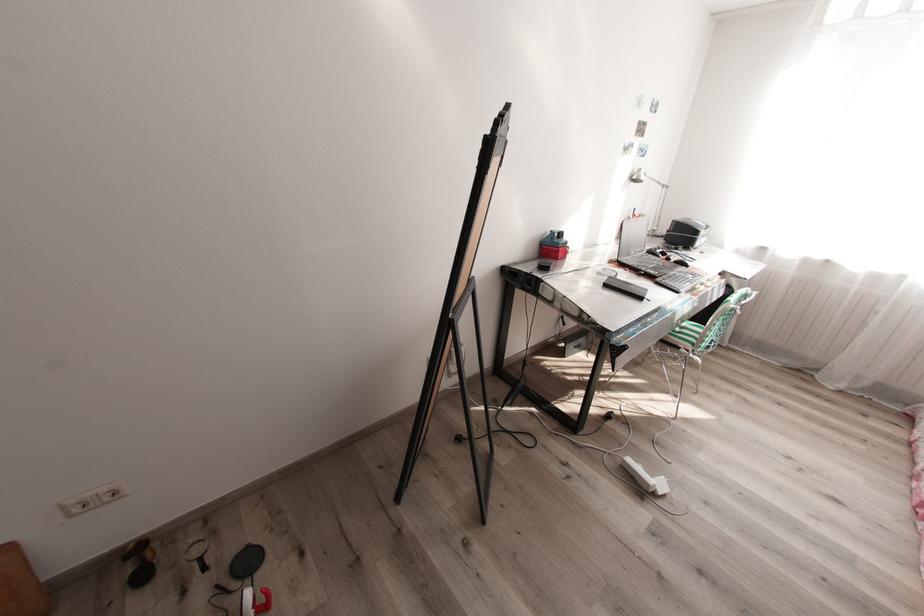
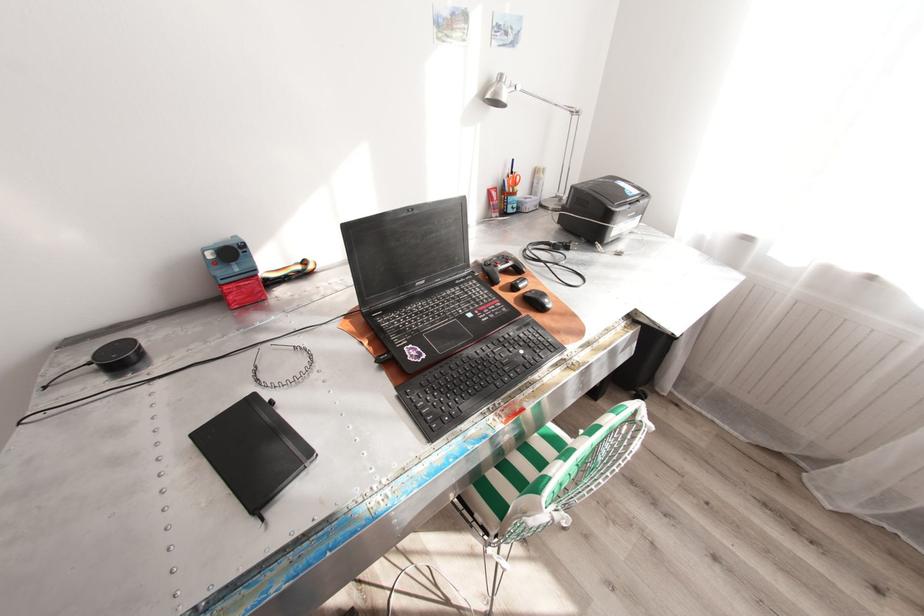
Find the pixel in the second image that matches (x=654, y=249) in the first image.

(490, 264)